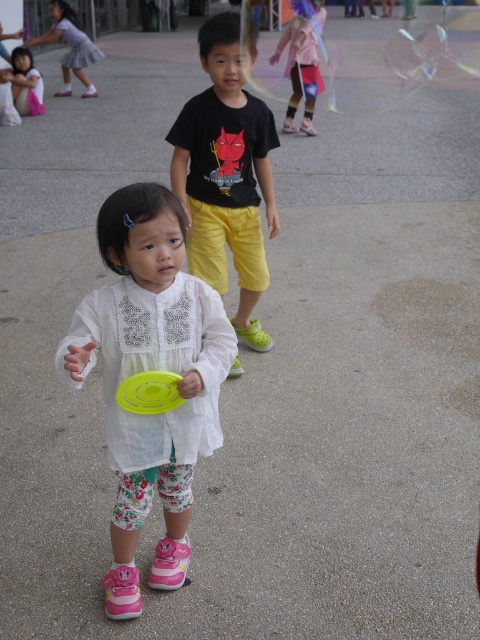
Consider the image. You are standing 10 feet away from the camera. Can you see the white floral leggings at center?

The white floral leggings at center and camera are 7.31 feet apart. Since you are standing 10 feet away from the camera, you are farther away than the leggings, so they might not be clearly visible or in your line of sight.